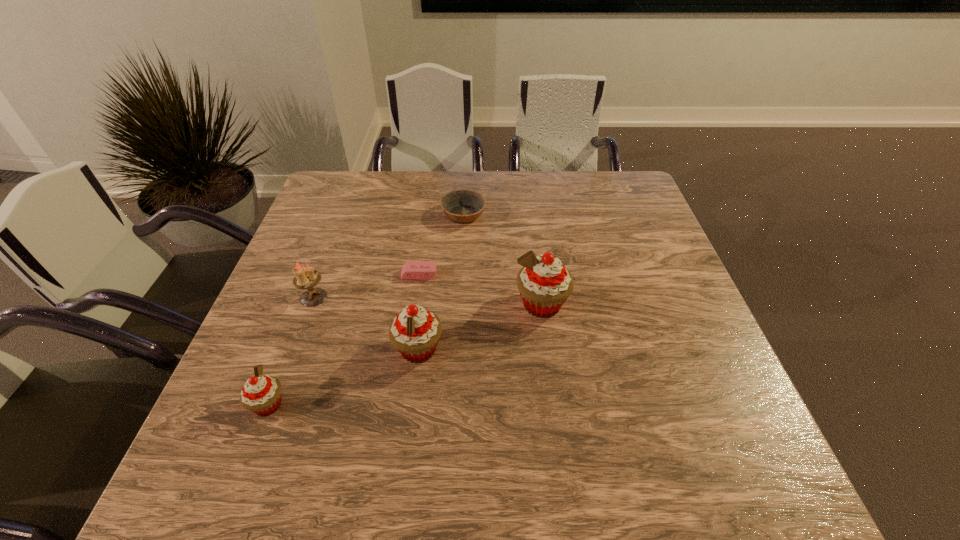
Where is `the third shortest object`? The height and width of the screenshot is (540, 960). the third shortest object is located at coordinates (261, 394).

The width and height of the screenshot is (960, 540). In order to click on the nearest cupcake in this screenshot , I will do `click(261, 394)`.

Where is `the second nearest cupcake`? the second nearest cupcake is located at coordinates (415, 332).

Where is `the second tallest object`? the second tallest object is located at coordinates (415, 332).

The width and height of the screenshot is (960, 540). In order to click on the farthest cupcake in this screenshot , I will do `click(544, 284)`.

The width and height of the screenshot is (960, 540). Identify the location of the rightmost object. (544, 284).

Identify the location of bowl. (461, 206).

Find the location of a particular element. the second shortest object is located at coordinates (461, 206).

Find the location of a particular element. the fifth nearest object is located at coordinates (411, 269).

I want to click on eraser, so click(411, 269).